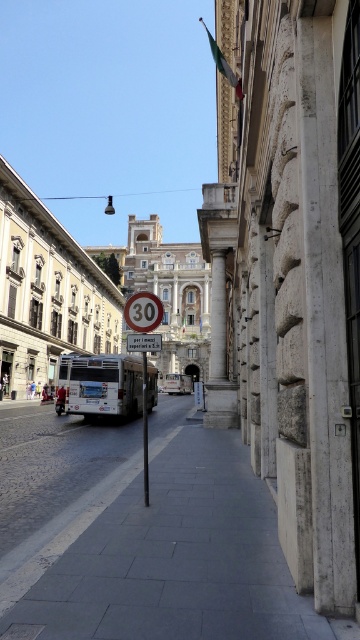
Question: Is metallic circular speed limit sign at center below white plastic speed limit sign at upper center?

Choices:
 (A) no
 (B) yes

Answer: (A)

Question: Which is farther from the green fabric flag at upper center?

Choices:
 (A) gray concrete pavement at center
 (B) metallic pole at center
 (C) metallic circular speed limit sign at center
 (D) white plastic speed limit sign at upper center

Answer: (D)

Question: Which is nearer to the metallic circular speed limit sign at center?

Choices:
 (A) white plastic speed limit sign at upper center
 (B) metallic pole at center
 (C) green fabric flag at upper center
 (D) gray concrete pavement at center

Answer: (A)

Question: Is gray concrete pavement at center positioned before white plastic speed limit sign at upper center?

Choices:
 (A) no
 (B) yes

Answer: (B)

Question: Is the position of white matte bus at center more distant than that of metallic circular speed limit sign at center?

Choices:
 (A) yes
 (B) no

Answer: (A)

Question: Among these objects, which one is nearest to the camera?

Choices:
 (A) gray concrete pavement at center
 (B) white matte bus at center
 (C) metallic pole at center

Answer: (A)